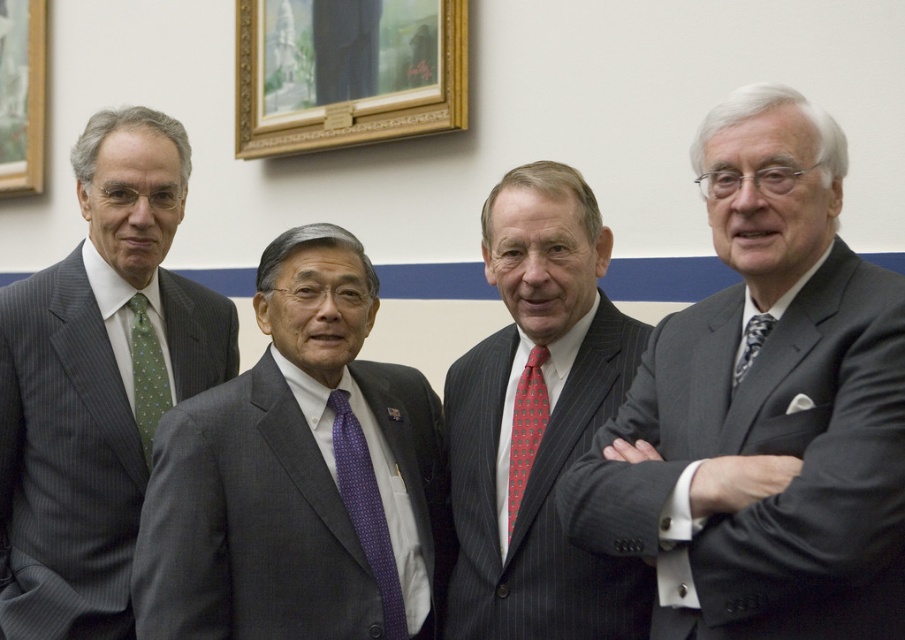
In the scene shown: Is wooden picture frame at upper left taller than red dotted tie at center?

Correct, wooden picture frame at upper left is much taller as red dotted tie at center.

Is point (17, 93) farther from viewer compared to point (522, 460)?

Yes, point (17, 93) is behind point (522, 460).

Identify the location of wooden picture frame at upper left. (21, 96).

Does point (511, 340) come in front of point (0, 10)?

Yes, it is in front of point (0, 10).

Is pinstriped suit at center above wooden picture frame at upper left?

Incorrect, pinstriped suit at center is not positioned above wooden picture frame at upper left.

Is point (624, 570) closer to viewer compared to point (12, 136)?

Yes, it is in front of point (12, 136).

Locate an element on the screen. The width and height of the screenshot is (905, 640). pinstriped suit at center is located at coordinates (538, 420).

Does matte black suit at left have a greater width compared to pinstriped suit at center?

No.

Is matte black suit at left closer to the viewer compared to pinstriped suit at center?

No, it is not.

Between point (58, 428) and point (491, 268), which one is positioned behind?

The point (491, 268) is behind.

This screenshot has height=640, width=905. Identify the location of matte black suit at left. (98, 381).